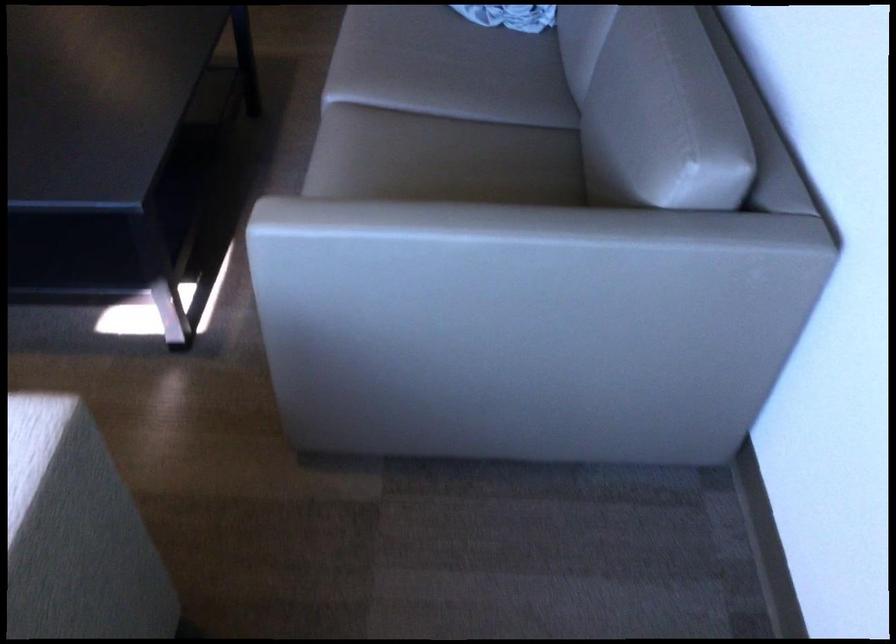
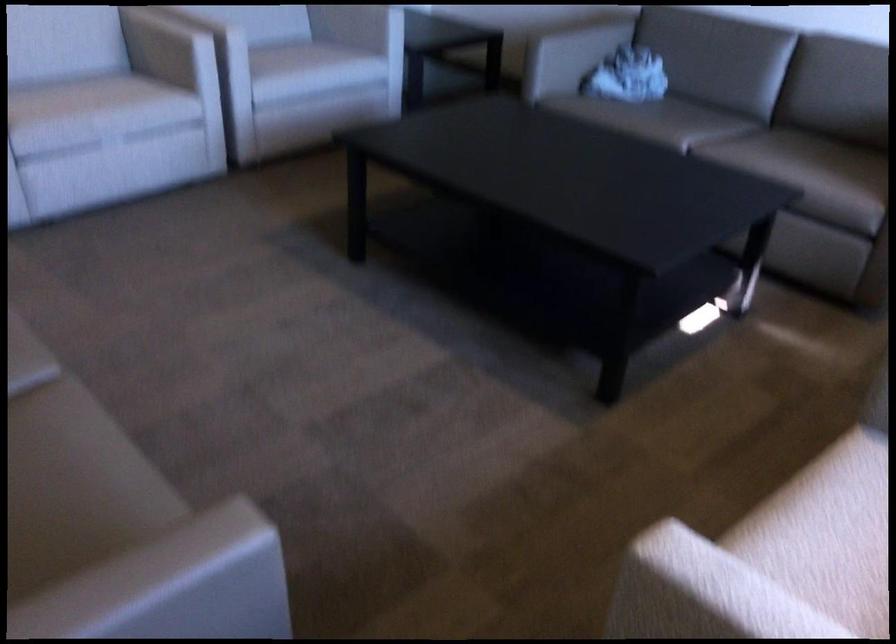
In the second image, find the point that corresponds to (444,100) in the first image.

(714, 127)